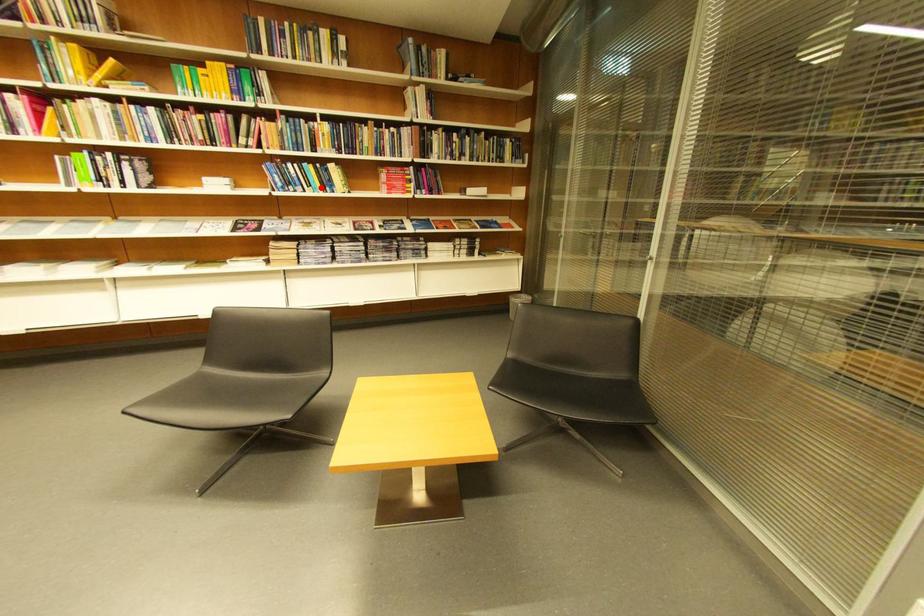
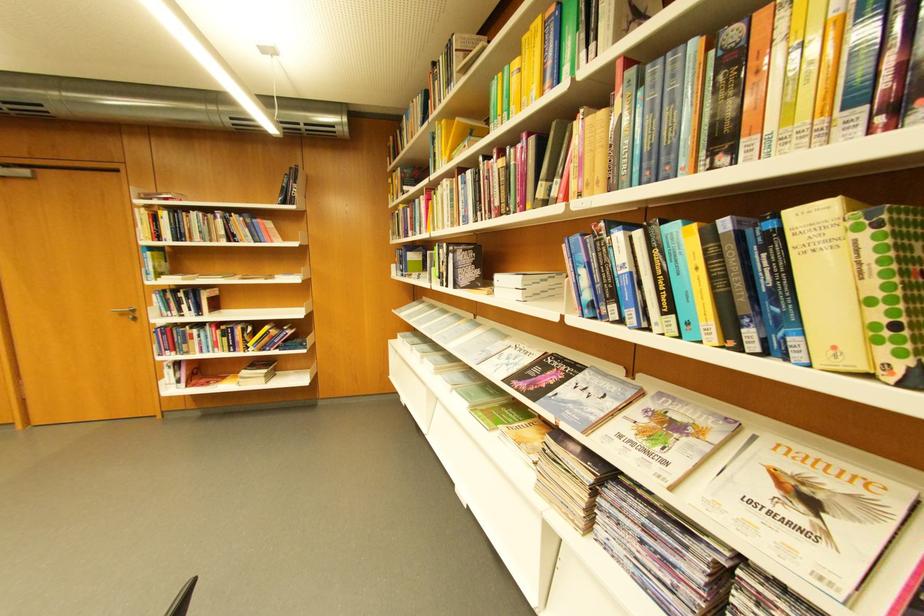
Locate, in the second image, the point that corresponds to the highlighted location in the first image.

(681, 310)